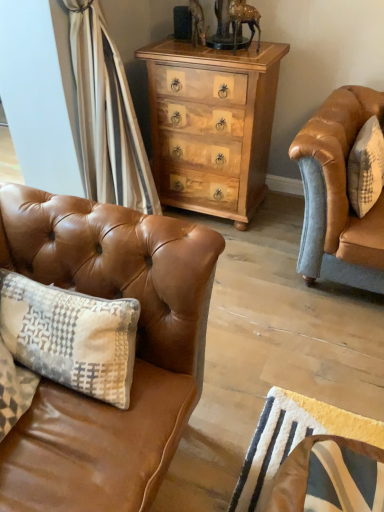
Find the location of `vacant area that lies between light brown wood chest of drawers at center and leather swivel chair at lower right`. vacant area that lies between light brown wood chest of drawers at center and leather swivel chair at lower right is located at coordinates (259, 327).